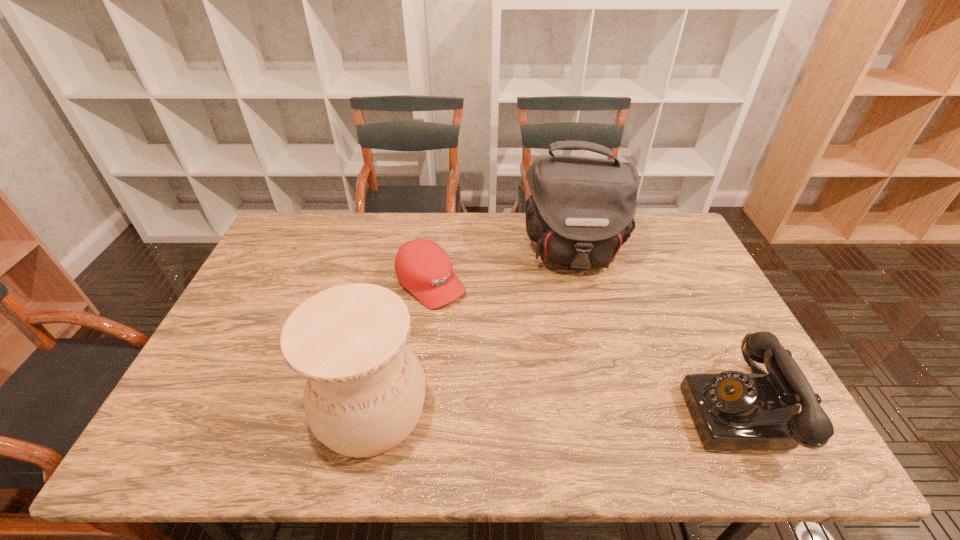
Locate an element on the screen. This screenshot has height=540, width=960. vacant point located 0.270m on the dial of the telephone is located at coordinates (572, 411).

Locate an element on the screen. The image size is (960, 540). vacant space located 0.100m on the dial of the telephone is located at coordinates (644, 411).

Identify the location of vacant space located 0.280m on the front-facing side of the shortest object. This screenshot has height=540, width=960. click(x=519, y=362).

What are the coordinates of `free space located 0.090m on the front-facing side of the shortest object` in the screenshot? It's located at (472, 321).

The height and width of the screenshot is (540, 960). I want to click on vacant space positioned 0.090m on the front-facing side of the shortest object, so click(472, 321).

Image resolution: width=960 pixels, height=540 pixels. I want to click on vacant position located 0.150m on the open flap of the tallest object, so click(x=579, y=321).

You are a GUI agent. You are given a task and a screenshot of the screen. Output one action in this format:
    pyautogui.click(x=<x>, y=<y>)
    Task: Click on the free location located on the open flap of the tallest object
    This screenshot has height=540, width=960.
    Given the screenshot: What is the action you would take?
    pyautogui.click(x=582, y=352)

In order to click on vacant space located 0.100m on the open flap of the tallest object in this screenshot , I will do `click(578, 308)`.

At what (x,y) coordinates should I click in order to perform the action: click on object that is at the far edge. Please return your answer as a coordinate pair (x, y). This screenshot has height=540, width=960. Looking at the image, I should click on (581, 210).

Identify the location of pottery that is at the near edge. The image size is (960, 540). (365, 388).